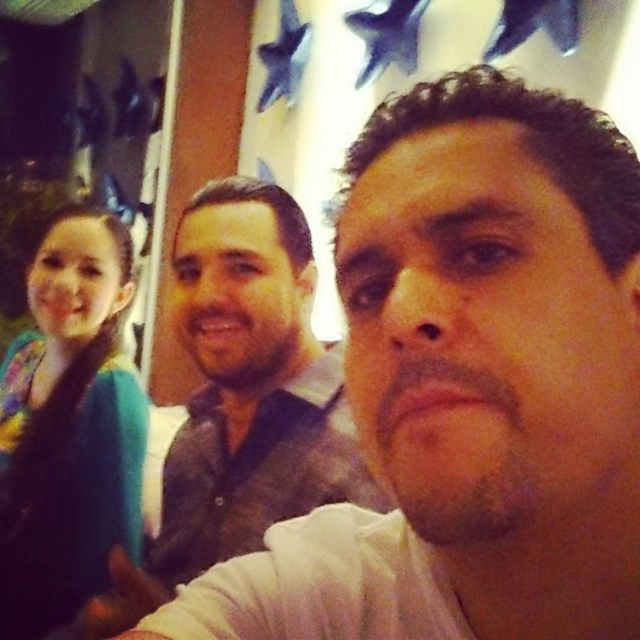
You are taking a selfie with two friends. You are wearing a white matte shirt at center, and your friend on the left is wearing a teal fabric shirt at left. If you want to ensure your shirts are not overlapping in the photo, what is the minimum distance you should maintain between the two shirts?

The minimum distance required between the white matte shirt at center and the teal fabric shirt at left to prevent overlap is 15.86 inches, as they are currently positioned at that distance apart.

You are taking a photo of two friends and yourself. You notice the white matte shirt at center and the teal fabric shirt at left in the frame. Which shirt appears higher in the photo?

The white matte shirt at center appears higher in the photo because it is positioned above the teal fabric shirt at left.

You are trying to locate the white matte shirt at center in the image. According to the coordinates provided, where would you look first?

You should look at point (250, 385) to find the white matte shirt at center.